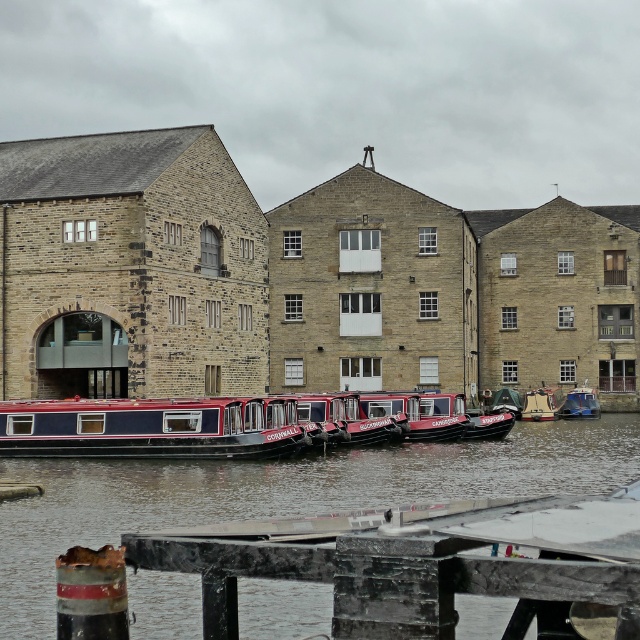
You are standing on the pier where the narrowboats are docked. You see a point marked at coordinates (276,493). What is located at that point?

The point at coordinates (276,493) marks smooth dark blue water at center.

Consider the image. You are standing at the pier where the narrowboats are docked. You want to take a photo of the smooth dark blue water at center using a camera that has a maximum focus range of 35 meters. Will the camera be able to focus on the water?

The smooth dark blue water at center and camera are 36.64 meters apart from each other. Since the camera has a maximum focus range of 35 meters, it cannot focus on the water because the distance exceeds its capability.